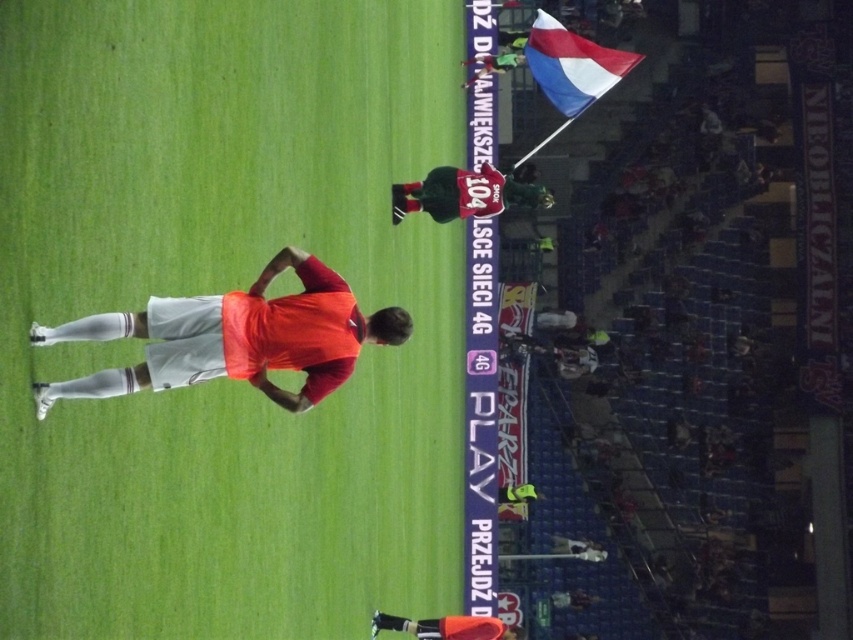
Is point (296, 317) closer to viewer compared to point (463, 632)?

Yes, point (296, 317) is closer to viewer.

This screenshot has height=640, width=853. What do you see at coordinates (236, 337) in the screenshot? I see `matte orange shirt at center` at bounding box center [236, 337].

I want to click on matte orange shirt at center, so click(x=236, y=337).

Does red and white fabric flag at upper right appear over orange jersey at upper center?

Yes, red and white fabric flag at upper right is above orange jersey at upper center.

Does red and white fabric flag at upper right have a greater width compared to orange jersey at upper center?

Indeed, red and white fabric flag at upper right has a greater width compared to orange jersey at upper center.

Describe the element at coordinates (572, 65) in the screenshot. I see `red and white fabric flag at upper right` at that location.

This screenshot has width=853, height=640. Find the location of `red and white fabric flag at upper right`. red and white fabric flag at upper right is located at coordinates (572, 65).

Which is more to the right, dark green jersey at upper center or orange matte shorts at lower center?

From the viewer's perspective, dark green jersey at upper center appears more on the right side.

Between dark green jersey at upper center and orange matte shorts at lower center, which one has less height?

With less height is dark green jersey at upper center.

This screenshot has height=640, width=853. Find the location of `dark green jersey at upper center`. dark green jersey at upper center is located at coordinates (465, 195).